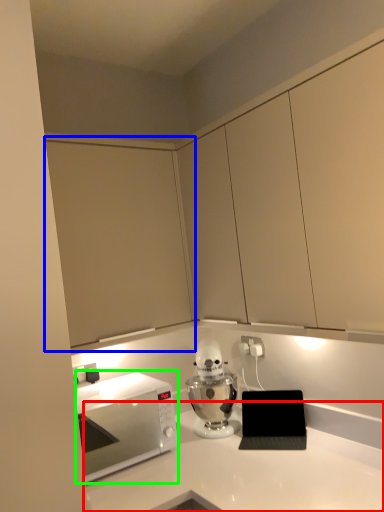
Question: Based on their relative distances, which object is farther from countertop (highlighted by a red box)? Choose from cabinetry (highlighted by a blue box) and microwave oven (highlighted by a green box).

Choices:
 (A) cabinetry
 (B) microwave oven

Answer: (A)